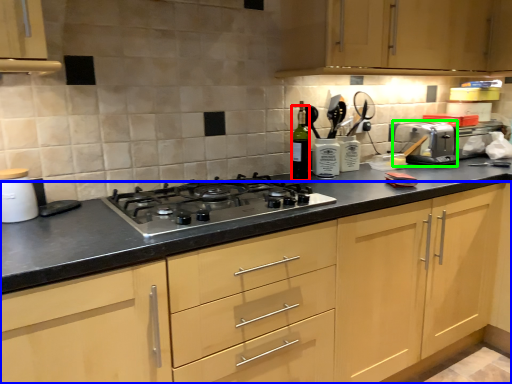
Question: Considering the real-world distances, which object is closest to bottle (highlighted by a red box)? cabinetry (highlighted by a blue box) or toaster (highlighted by a green box).

Choices:
 (A) cabinetry
 (B) toaster

Answer: (A)